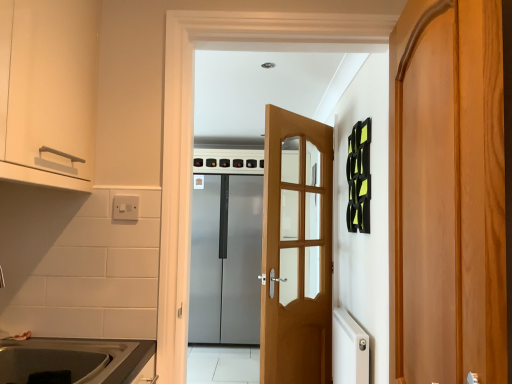
Question: From the image's perspective, is matte stainless steel sink at lower left above wooden door at right, the first door from the front?

Choices:
 (A) yes
 (B) no

Answer: (B)

Question: Is matte stainless steel sink at lower left in front of wooden door at right, which appears as the 3th door when viewed from the back?

Choices:
 (A) yes
 (B) no

Answer: (B)

Question: From a real-world perspective, is matte stainless steel sink at lower left positioned under wooden door at right, which appears as the 3th door when viewed from the back, based on gravity?

Choices:
 (A) no
 (B) yes

Answer: (B)

Question: Can you confirm if matte stainless steel sink at lower left is taller than wooden door at right, which appears as the 3th door when viewed from the back?

Choices:
 (A) no
 (B) yes

Answer: (A)

Question: Is matte stainless steel sink at lower left directly adjacent to wooden door at right, the first door viewed from the right?

Choices:
 (A) yes
 (B) no

Answer: (B)

Question: Does matte stainless steel sink at lower left have a greater width compared to wooden door at right, which appears as the 3th door when viewed from the back?

Choices:
 (A) no
 (B) yes

Answer: (B)

Question: From a real-world perspective, is matte white cabinet at upper left under satin silver refrigerator at center, the first door when ordered from back to front?

Choices:
 (A) no
 (B) yes

Answer: (A)

Question: Considering the relative sizes of matte white cabinet at upper left and satin silver refrigerator at center, arranged as the 3th door when viewed from the front, in the image provided, is matte white cabinet at upper left thinner than satin silver refrigerator at center, arranged as the 3th door when viewed from the front,?

Choices:
 (A) no
 (B) yes

Answer: (B)

Question: Is satin silver refrigerator at center, the first door when ordered from back to front, surrounded by matte white cabinet at upper left?

Choices:
 (A) no
 (B) yes

Answer: (A)

Question: Is matte white cabinet at upper left oriented towards satin silver refrigerator at center, the first door when ordered from back to front?

Choices:
 (A) no
 (B) yes

Answer: (A)

Question: Can we say matte white cabinet at upper left lies outside satin silver refrigerator at center, the first door when ordered from back to front?

Choices:
 (A) no
 (B) yes

Answer: (B)

Question: Does matte white cabinet at upper left lie in front of satin silver refrigerator at center, the third door viewed from the right?

Choices:
 (A) no
 (B) yes

Answer: (B)

Question: Is light brown wooden door at center, the second door positioned from the back, at the left side of wooden door at right, the first door viewed from the right?

Choices:
 (A) no
 (B) yes

Answer: (B)